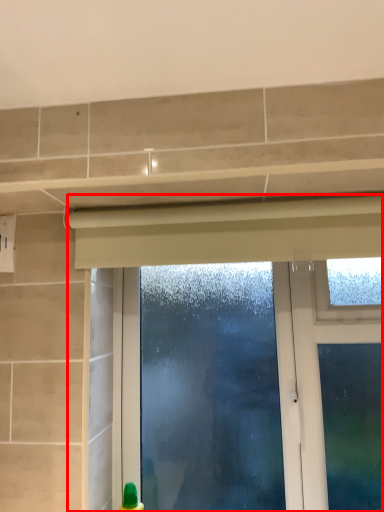
Question: From the image's perspective, what is the correct spatial positioning of window (annotated by the red box) in reference to curtain?

Choices:
 (A) above
 (B) below

Answer: (B)